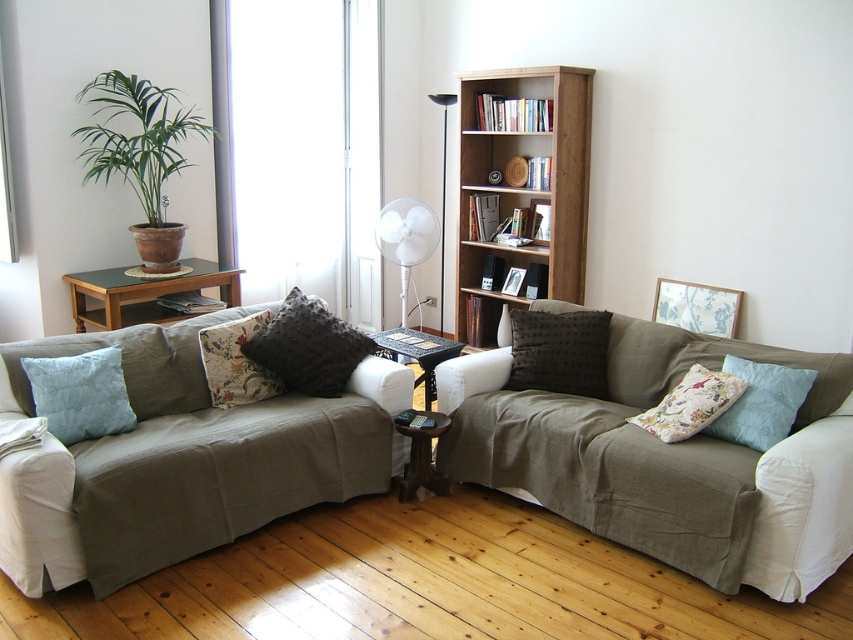
Question: Which of the following is the closest to the observer?

Choices:
 (A) dark brown textured pillow at center
 (B) light blue quilted pillow at left
 (C) light blue fabric pillow at lower right

Answer: (C)

Question: Is light blue quilted pillow at left above transparent plastic floor lamp at center?

Choices:
 (A) yes
 (B) no

Answer: (B)

Question: Does textured dark gray pillow at center have a larger size compared to light blue fabric pillow at lower right?

Choices:
 (A) no
 (B) yes

Answer: (B)

Question: Which point is farther to the camera?

Choices:
 (A) (573, 337)
 (B) (134, 493)
 (C) (86, 289)
 (D) (352, 170)

Answer: (D)

Question: Among these points, which one is nearest to the camera?

Choices:
 (A) (267, 362)
 (B) (722, 298)

Answer: (A)

Question: Can you confirm if floral fabric picture frame at upper right is positioned below wooden picture frame at center?

Choices:
 (A) no
 (B) yes

Answer: (B)